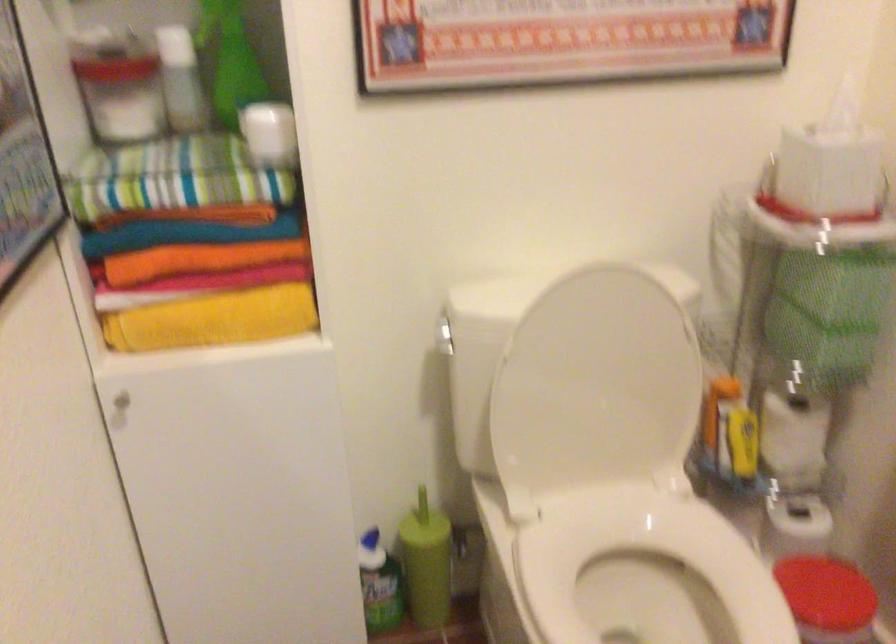
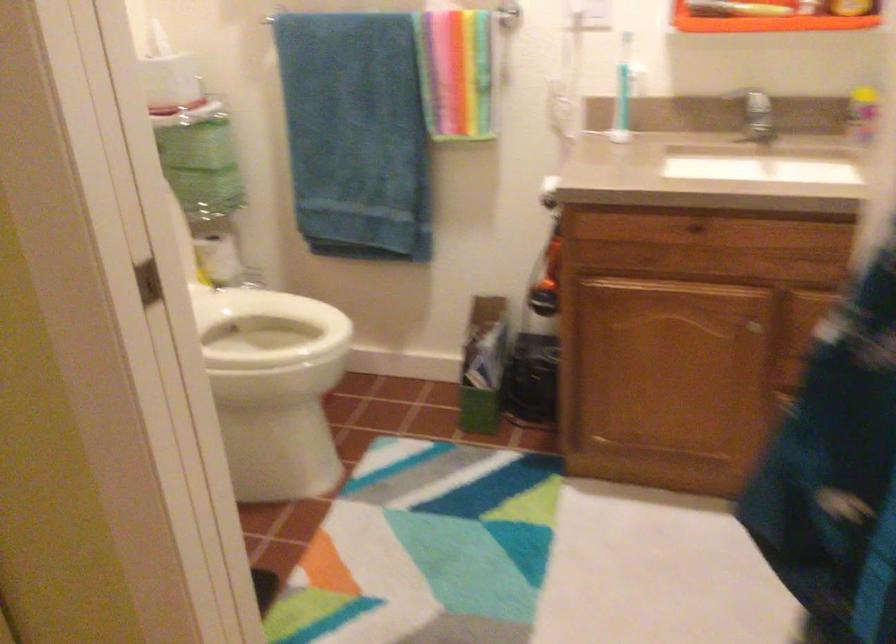
In the second image, find the point that corresponds to point (793, 442) in the first image.

(219, 259)